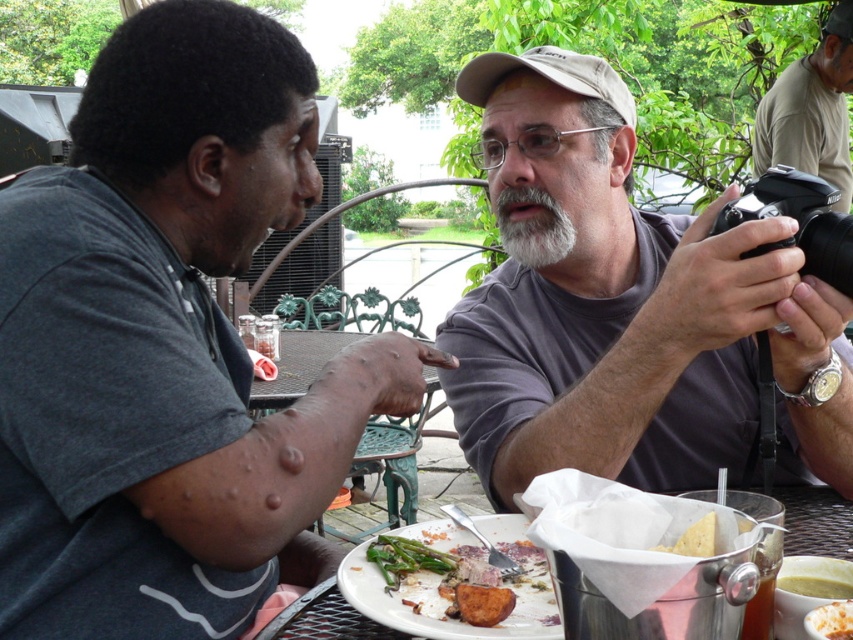
You are a food critic who needs to take a photo of the green asparagus at center and the golden crispy fries at lower right. Which of the two items is taller?

The green asparagus at center is taller than the golden crispy fries at lower right.

You are a food critic who wants to take a photo of the green asparagus at center and golden crispy fries at lower right. Since you are sitting at the table, which item is closer to your left side?

The green asparagus at center is to the left of golden crispy fries at lower right, so the green asparagus at center is closer to your left side.

You are sitting at the metal table with the black mesh design. You want to place a small vase between the two points labeled point [457,376] and point [428,625]. Which point should the vase be closer to in order to be placed behind the second point?

The vase should be closer to point [428,625] because point [457,376] is behind point [428,625], so placing it near the latter keeps it in front of the first point.